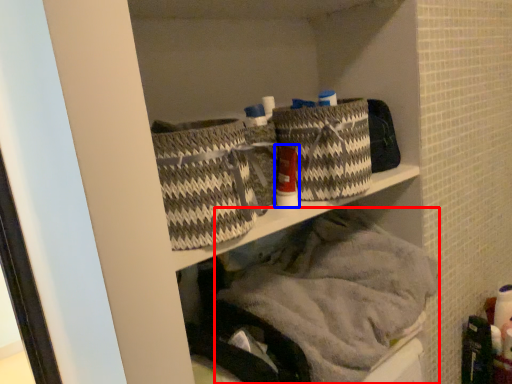
Question: Which of the following is the closest to the observer, material (highlighted by a red box) or toiletry (highlighted by a blue box)?

Choices:
 (A) material
 (B) toiletry

Answer: (A)